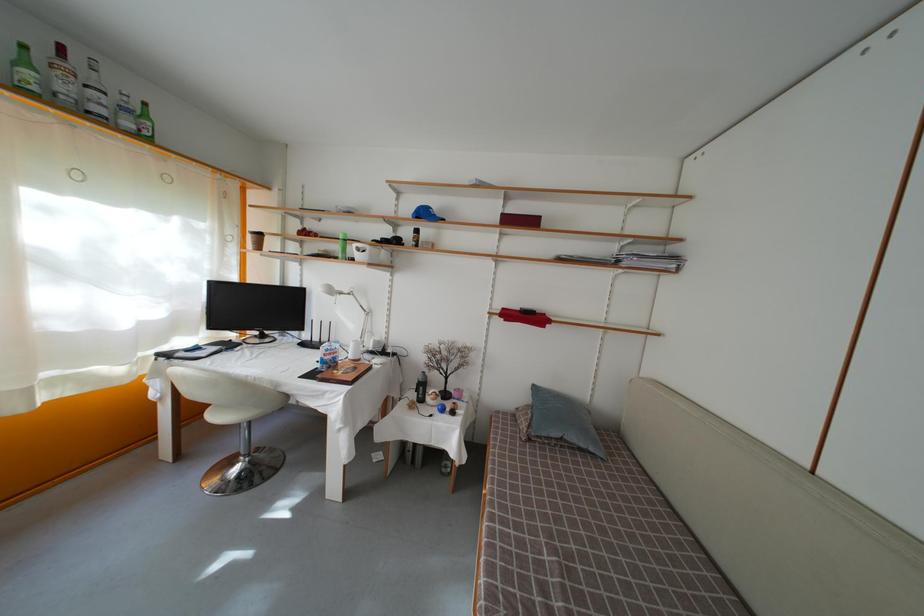
Locate an element on the screen. green spray bottle is located at coordinates (25, 71).